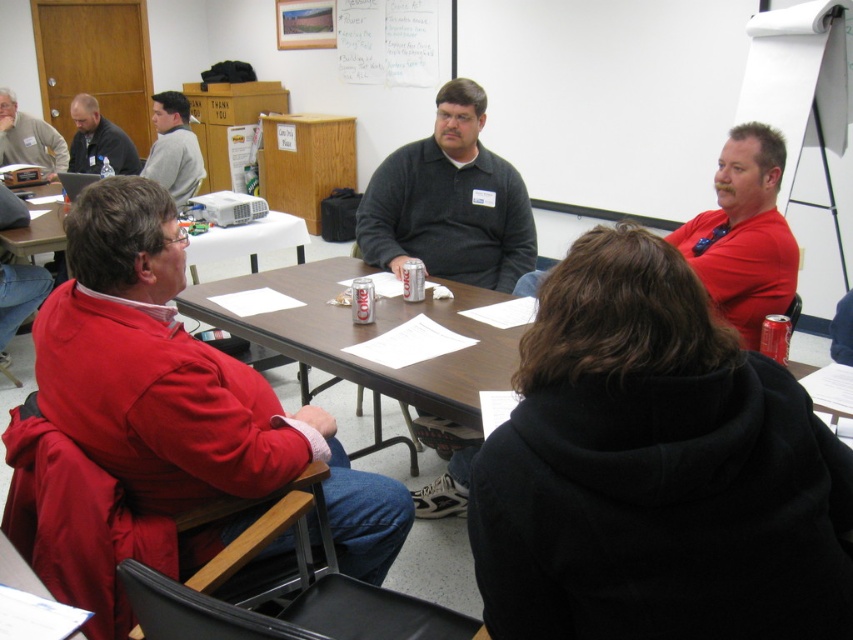
Between point (567, 387) and point (368, 198), which one is positioned in front?

Positioned in front is point (567, 387).

Is point (583, 484) positioned before point (489, 154)?

That is True.

Find the location of `black fleece jacket at center`. black fleece jacket at center is located at coordinates (654, 468).

Locate an element on the screen. This screenshot has height=640, width=853. red matte jacket at left is located at coordinates (183, 385).

Is red matte jacket at left thinner than matte gray shirt at upper left?

No.

Between point (375, 504) and point (51, 157), which one is positioned in front?

Point (375, 504) is in front.

I want to click on red matte jacket at left, so click(183, 385).

Which is below, red matte jacket at left or dark gray sweater at upper left?

red matte jacket at left is lower down.

Is point (200, 460) positioned in front of point (97, 156)?

That is True.

Which is behind, point (50, 362) or point (80, 129)?

The point (80, 129) is behind.

Where is `red matte jacket at left`? This screenshot has width=853, height=640. red matte jacket at left is located at coordinates (183, 385).